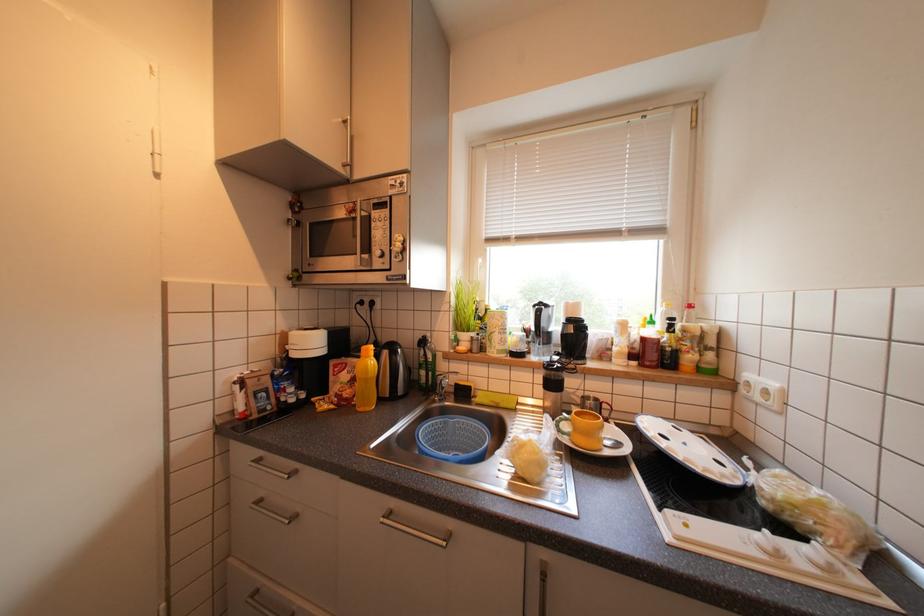
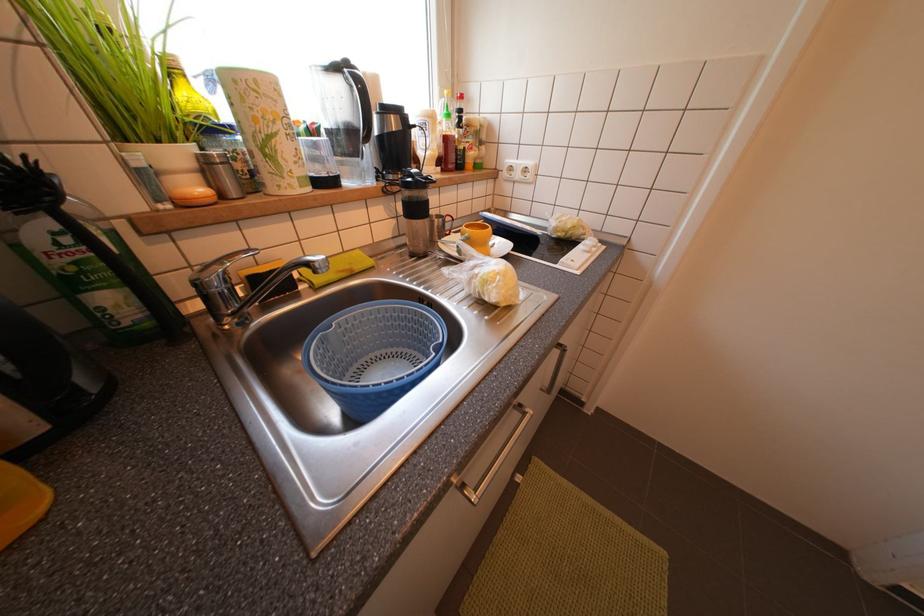
The images are taken continuously from a first-person perspective. In which direction is your viewpoint rotating?

The camera's rotation is toward right-down.